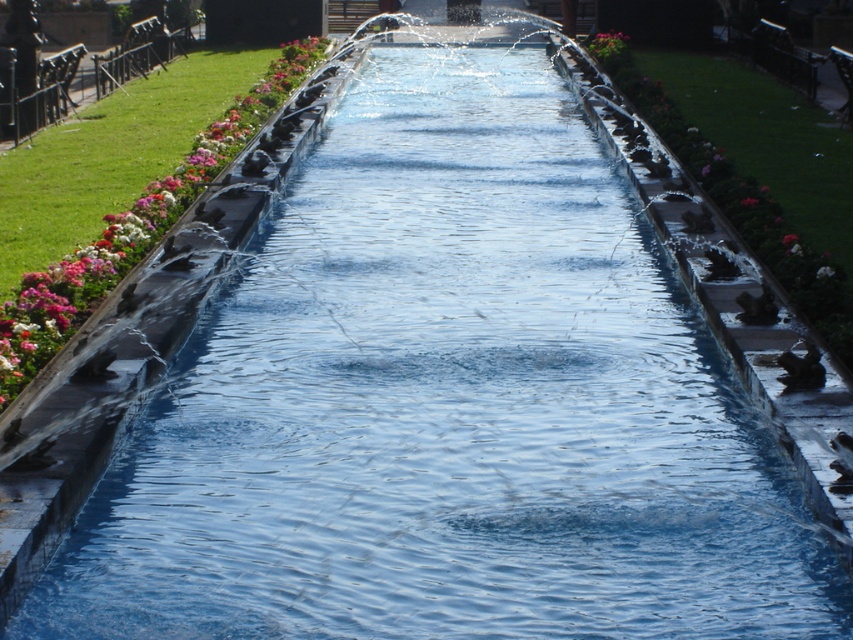
Question: Is pink glossy flower at left closer to the viewer compared to pink matte flower at center?

Choices:
 (A) no
 (B) yes

Answer: (B)

Question: Among these points, which one is farthest from the camera?

Choices:
 (A) (791, 243)
 (B) (57, 307)
 (C) (599, 51)

Answer: (C)

Question: Does pink glossy flower at left appear over pink matte flower at center?

Choices:
 (A) yes
 (B) no

Answer: (A)

Question: Is pink glossy flower at left smaller than pink matte flower at center?

Choices:
 (A) yes
 (B) no

Answer: (B)

Question: Which of the following is the closest to the observer?

Choices:
 (A) pink glossy flower at left
 (B) pink matte flower at upper center
 (C) pink matte flower at center

Answer: (A)

Question: Which of these objects is positioned farthest from the pink matte flower at center?

Choices:
 (A) pink glossy flower at left
 (B) pink matte flower at upper center

Answer: (B)